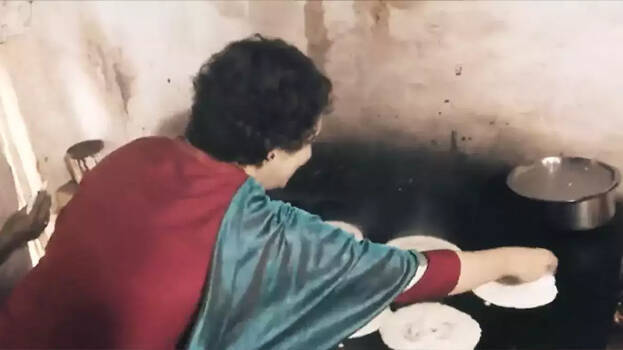
The width and height of the screenshot is (623, 350). Identify the location of cook top. (473, 218).